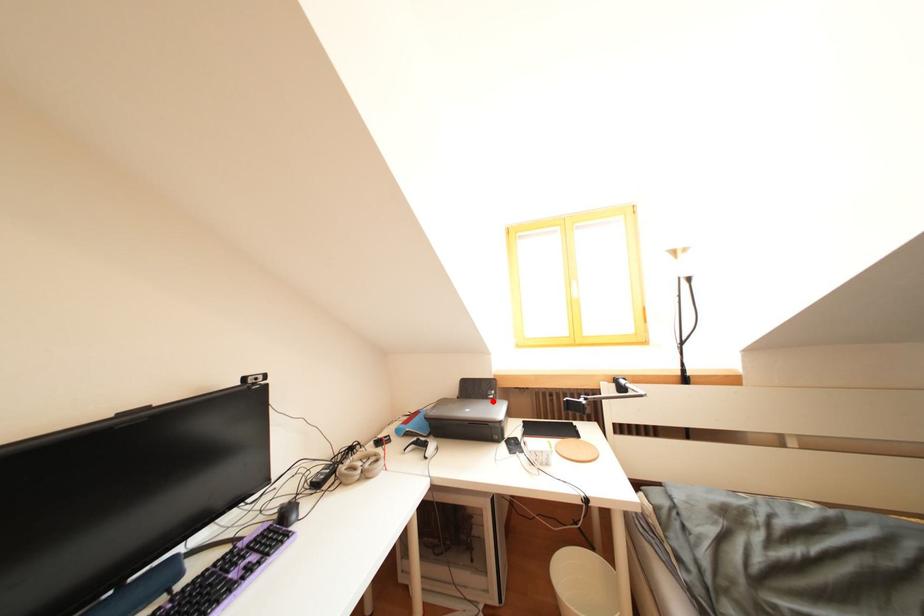
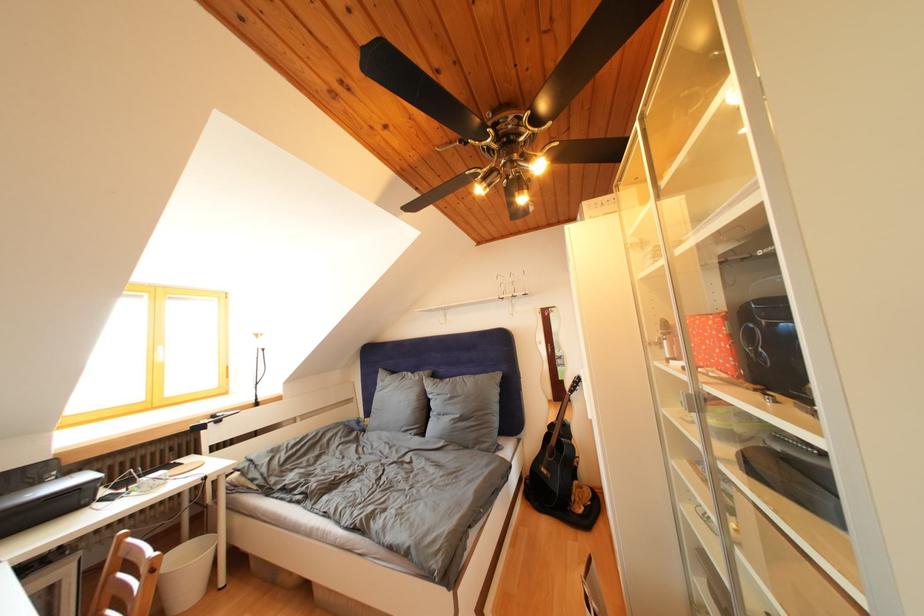
Question: A red point is marked in image1. In image2, is the corresponding 3D point closer to the camera or farther? Reply with the corresponding letter.

Choices:
 (A) The corresponding 3D point is closer.
 (B) The corresponding 3D point is farther.

Answer: (A)